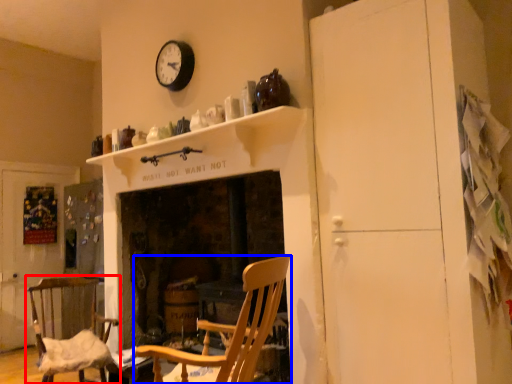
Question: Which object is closer to the camera taking this photo, chair (highlighted by a red box) or chair (highlighted by a blue box)?

Choices:
 (A) chair
 (B) chair

Answer: (B)